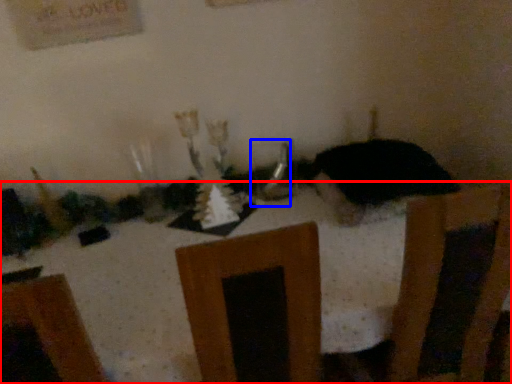
Question: Among these objects, which one is farthest to the camera, furniture (highlighted by a red box) or tableware (highlighted by a blue box)?

Choices:
 (A) furniture
 (B) tableware

Answer: (B)